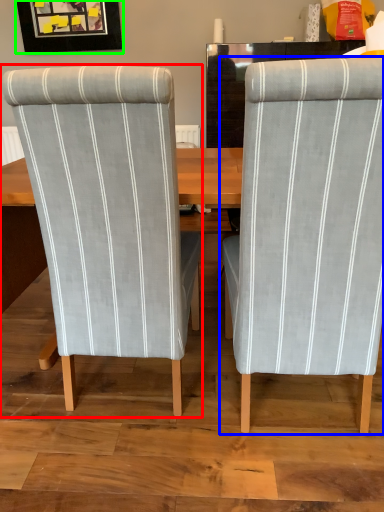
Question: Which object is the farthest from chair (highlighted by a red box)? Choose among these: chair (highlighted by a blue box) or picture frame (highlighted by a green box).

Choices:
 (A) chair
 (B) picture frame

Answer: (B)